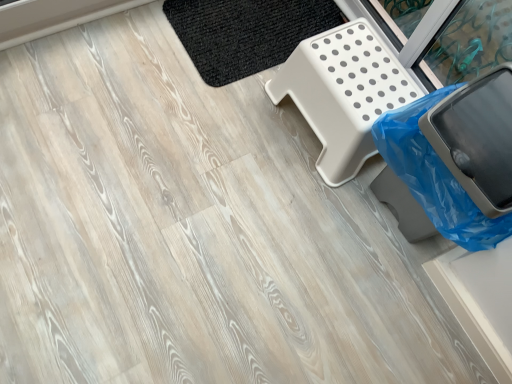
Question: Based on their positions, is black woven mat at upper center located to the left or right of blue plastic trash can at lower right?

Choices:
 (A) left
 (B) right

Answer: (A)

Question: In terms of size, does black woven mat at upper center appear bigger or smaller than blue plastic trash can at lower right?

Choices:
 (A) big
 (B) small

Answer: (B)

Question: Considering the real-world distances, which object is farthest from the white plastic step stool at upper right?

Choices:
 (A) blue plastic trash can at lower right
 (B) black woven mat at upper center

Answer: (B)

Question: Which object is positioned closest to the black woven mat at upper center?

Choices:
 (A) white plastic step stool at upper right
 (B) blue plastic trash can at lower right

Answer: (A)